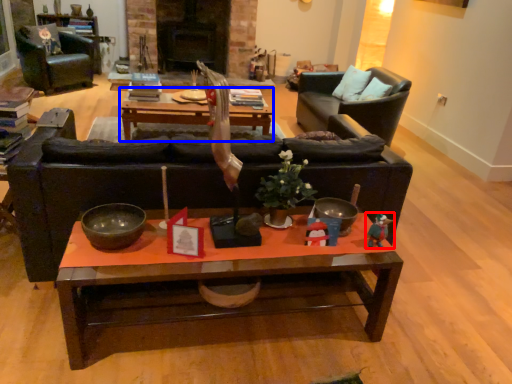
Question: Which of the following is the farthest to the observer, toy (highlighted by a red box) or coffee table (highlighted by a blue box)?

Choices:
 (A) toy
 (B) coffee table

Answer: (B)